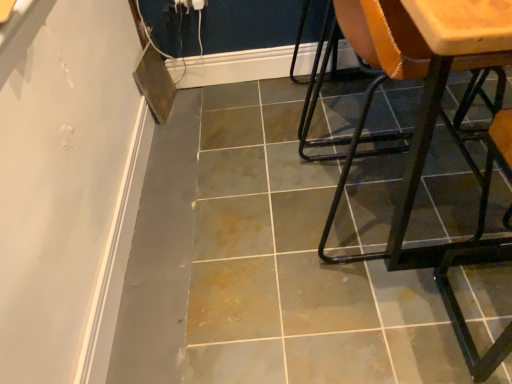
Where is `free spot above gray tile floor at center (from a real-world perspective)`? The width and height of the screenshot is (512, 384). free spot above gray tile floor at center (from a real-world perspective) is located at coordinates (309, 196).